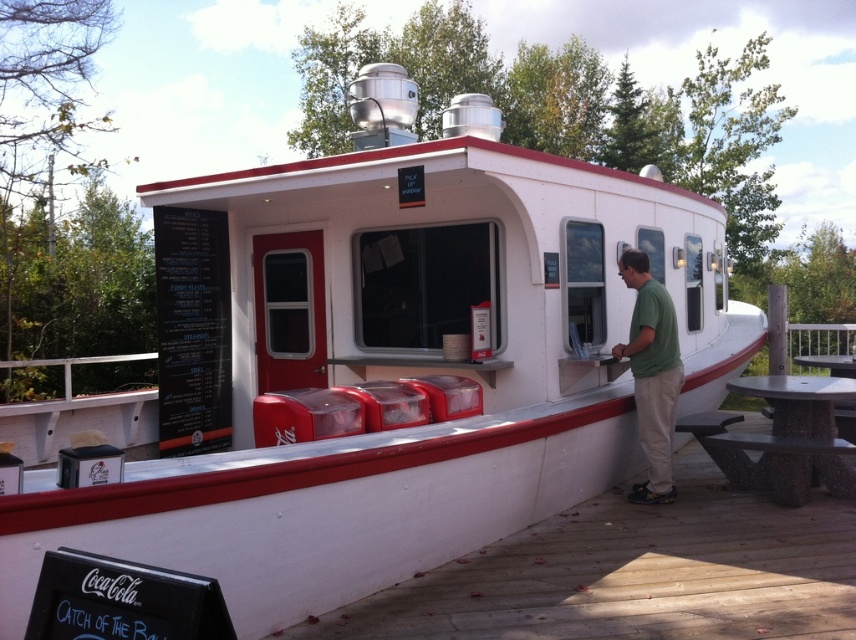
Can you confirm if wooden at lower left is thinner than green cotton shirt at center?

No.

Between point (646, 604) and point (642, 292), which one is positioned behind?

Point (642, 292)

Between point (788, 605) and point (676, 396), which one is positioned in front?

Point (788, 605) is more forward.

At what (x,y) coordinates should I click in order to perform the action: click on wooden at lower left. Please return your answer as a coordinate pair (x, y). Looking at the image, I should click on (634, 573).

Is wooden at lower left thinner than dark brown stone picnic table at lower right?

No, wooden at lower left is not thinner than dark brown stone picnic table at lower right.

Can you confirm if wooden at lower left is positioned to the left of dark brown stone picnic table at lower right?

Correct, you'll find wooden at lower left to the left of dark brown stone picnic table at lower right.

Where is `wooden at lower left`? wooden at lower left is located at coordinates (634, 573).

Locate an element on the screen. This screenshot has height=640, width=856. wooden at lower left is located at coordinates (634, 573).

Is dark brown stone picnic table at lower right further to camera compared to green cotton shirt at center?

No, dark brown stone picnic table at lower right is closer to the viewer.

Which is behind, point (801, 442) or point (651, 493)?

Positioned behind is point (651, 493).

Where is `dark brown stone picnic table at lower right`? This screenshot has height=640, width=856. dark brown stone picnic table at lower right is located at coordinates (798, 435).